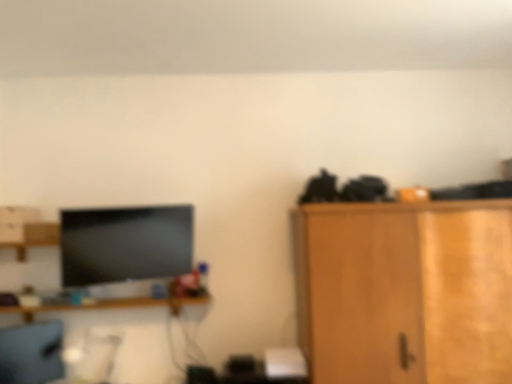
Question: Can you confirm if wooden cabinet at right is bigger than wooden shelf at center?

Choices:
 (A) yes
 (B) no

Answer: (A)

Question: Is wooden cabinet at right at the left side of wooden shelf at center?

Choices:
 (A) yes
 (B) no

Answer: (B)

Question: Is wooden cabinet at right outside wooden shelf at center?

Choices:
 (A) no
 (B) yes

Answer: (B)

Question: Is the surface of wooden cabinet at right in direct contact with wooden shelf at center?

Choices:
 (A) no
 (B) yes

Answer: (A)

Question: Is wooden cabinet at right oriented towards wooden shelf at center?

Choices:
 (A) no
 (B) yes

Answer: (A)

Question: From a real-world perspective, is wooden shelf at center positioned above or below wooden cabinet at right?

Choices:
 (A) below
 (B) above

Answer: (B)

Question: Relative to wooden cabinet at right, is wooden shelf at center in front or behind?

Choices:
 (A) behind
 (B) front

Answer: (A)

Question: In terms of width, does wooden shelf at center look wider or thinner when compared to wooden cabinet at right?

Choices:
 (A) thin
 (B) wide

Answer: (A)

Question: Is point (103, 304) positioned closer to the camera than point (295, 243)?

Choices:
 (A) closer
 (B) farther

Answer: (A)

Question: Visually, is wooden cabinet at right positioned to the left or to the right of matte gray computer chair at lower left?

Choices:
 (A) left
 (B) right

Answer: (B)

Question: In terms of width, does wooden cabinet at right look wider or thinner when compared to matte gray computer chair at lower left?

Choices:
 (A) wide
 (B) thin

Answer: (A)

Question: From a real-world perspective, relative to matte gray computer chair at lower left, is wooden cabinet at right vertically above or below?

Choices:
 (A) below
 (B) above

Answer: (B)

Question: Choose the correct answer: Is wooden cabinet at right inside matte gray computer chair at lower left or outside it?

Choices:
 (A) outside
 (B) inside

Answer: (A)

Question: From a real-world perspective, relative to matte gray computer chair at lower left, is wooden shelf at center vertically above or below?

Choices:
 (A) below
 (B) above

Answer: (B)

Question: Considering the positions of point (101, 302) and point (40, 357), is point (101, 302) closer or farther from the camera than point (40, 357)?

Choices:
 (A) closer
 (B) farther

Answer: (A)